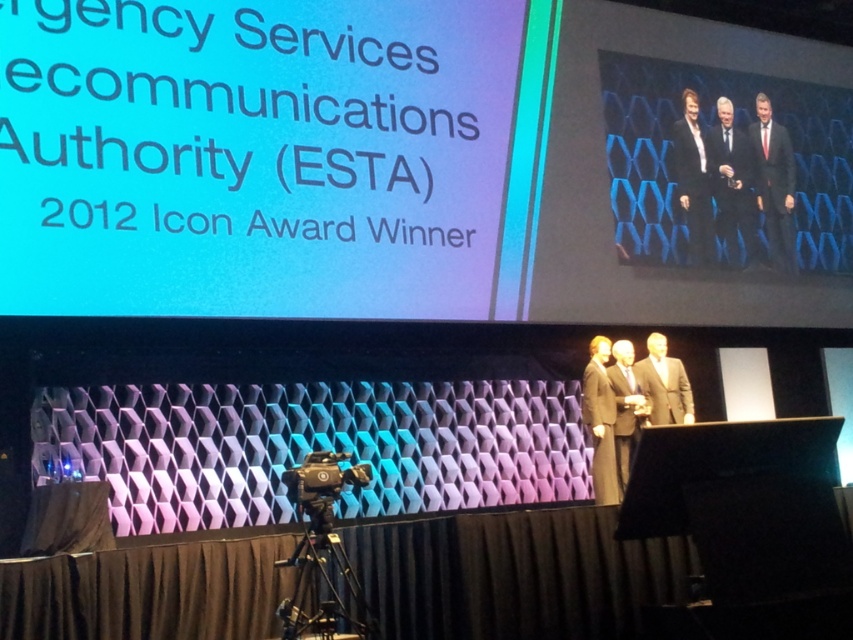
Is black matte tripod at lower center taller than satin gold suit at center?

Correct, black matte tripod at lower center is much taller as satin gold suit at center.

Is black matte tripod at lower center thinner than satin gold suit at center?

No, black matte tripod at lower center is not thinner than satin gold suit at center.

Where is `black matte tripod at lower center`? Image resolution: width=853 pixels, height=640 pixels. black matte tripod at lower center is located at coordinates (321, 579).

The width and height of the screenshot is (853, 640). Find the location of `black suit at upper right`. black suit at upper right is located at coordinates (733, 182).

Who is more distant from viewer, (x=732, y=113) or (x=662, y=339)?

The point (x=732, y=113) is behind.

Describe the element at coordinates (733, 182) in the screenshot. This screenshot has height=640, width=853. I see `black suit at upper right` at that location.

The image size is (853, 640). I want to click on black suit at upper right, so click(x=733, y=182).

Is matte black text at upper left shorter than satin gold suit at center?

Incorrect, matte black text at upper left's height does not fall short of satin gold suit at center's.

Who is positioned more to the left, matte black text at upper left or satin gold suit at center?

matte black text at upper left

Does point (199, 33) lie behind point (637, 376)?

No, (199, 33) is in front of (637, 376).

I want to click on matte black text at upper left, so click(265, 156).